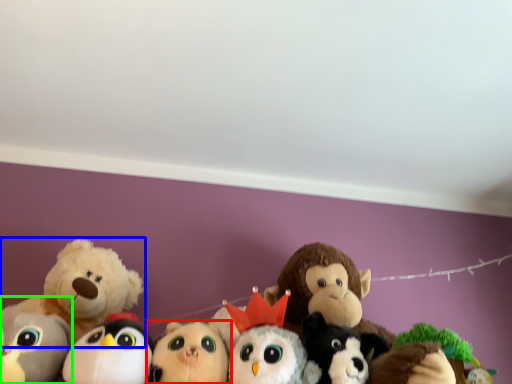
Question: Which is farther away from toy (highlighted by a red box)? toy (highlighted by a blue box) or toy (highlighted by a green box)?

Choices:
 (A) toy
 (B) toy

Answer: (A)